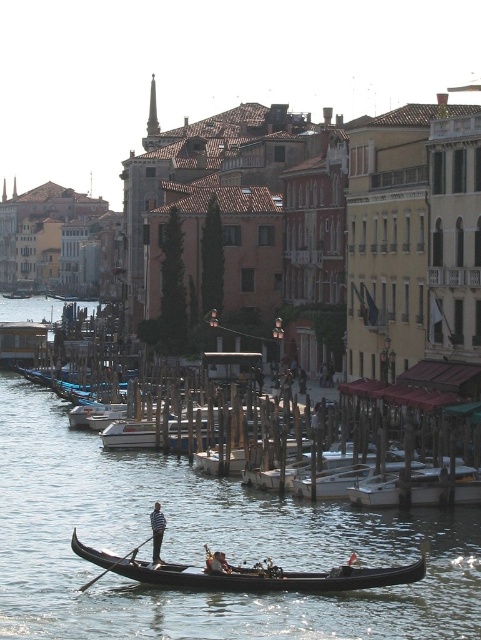
Does point (330, 580) lie in front of point (159, 502)?

Yes, point (330, 580) is closer to viewer.

Who is more forward, (144,540) or (152,557)?

Point (152,557) is more forward.

Locate an element on the screen. black polished wood gondola at lower center is located at coordinates (251, 573).

Is white wooden dock at center positioned behind dark brown leather oarsman at center?

Yes, it is behind dark brown leather oarsman at center.

Between white wooden dock at center and dark brown leather oarsman at center, which one appears on the right side from the viewer's perspective?

From the viewer's perspective, white wooden dock at center appears more on the right side.

This screenshot has width=481, height=640. Describe the element at coordinates (376, 492) in the screenshot. I see `white wooden dock at center` at that location.

This screenshot has width=481, height=640. I want to click on white wooden dock at center, so click(x=376, y=492).

The width and height of the screenshot is (481, 640). Describe the element at coordinates (202, 544) in the screenshot. I see `wooden docked boats at center` at that location.

Between point (364, 632) and point (217, 566), which one is positioned in front?

Point (364, 632) is in front.

Find the location of a particular element. The image size is (481, 640). wooden docked boats at center is located at coordinates (202, 544).